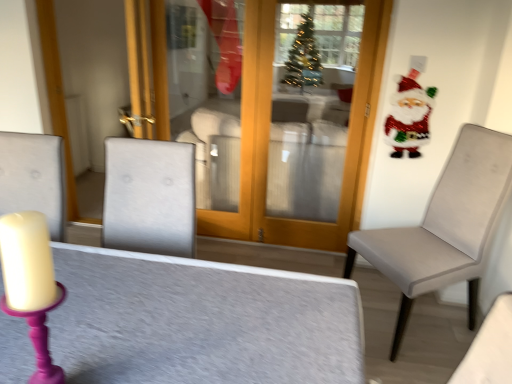
Question: Is matte gray chair at right surrounding shiny sequined santa at upper right?

Choices:
 (A) no
 (B) yes

Answer: (A)

Question: Is shiny sequined santa at upper right at the back of matte gray chair at right?

Choices:
 (A) yes
 (B) no

Answer: (B)

Question: Considering the relative sizes of matte gray chair at right and shiny sequined santa at upper right in the image provided, is matte gray chair at right smaller than shiny sequined santa at upper right?

Choices:
 (A) yes
 (B) no

Answer: (B)

Question: Would you say matte gray chair at right is outside shiny sequined santa at upper right?

Choices:
 (A) yes
 (B) no

Answer: (A)

Question: From the image's perspective, is matte gray chair at right located beneath shiny sequined santa at upper right?

Choices:
 (A) yes
 (B) no

Answer: (A)

Question: Considering the relative sizes of matte gray chair at right and shiny sequined santa at upper right in the image provided, is matte gray chair at right thinner than shiny sequined santa at upper right?

Choices:
 (A) yes
 (B) no

Answer: (B)

Question: Is the depth of textured gray table at center greater than that of matte gray chair at right?

Choices:
 (A) no
 (B) yes

Answer: (A)

Question: Can you confirm if textured gray table at center is positioned to the right of matte gray chair at right?

Choices:
 (A) yes
 (B) no

Answer: (B)

Question: Is the depth of textured gray table at center less than that of matte gray chair at right?

Choices:
 (A) no
 (B) yes

Answer: (B)

Question: Does textured gray table at center have a lesser height compared to matte gray chair at right?

Choices:
 (A) no
 (B) yes

Answer: (B)

Question: Considering the relative positions of textured gray table at center and matte gray chair at right in the image provided, is textured gray table at center to the left of matte gray chair at right from the viewer's perspective?

Choices:
 (A) no
 (B) yes

Answer: (B)

Question: From the image's perspective, does textured gray table at center appear lower than matte gray chair at right?

Choices:
 (A) yes
 (B) no

Answer: (A)

Question: Is shiny sequined santa at upper right aimed at textured gray table at center?

Choices:
 (A) no
 (B) yes

Answer: (A)